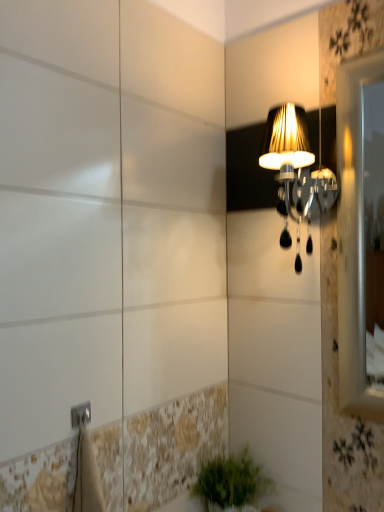
Image resolution: width=384 pixels, height=512 pixels. What are the coordinates of `matte black lampshade at upper right` in the screenshot? It's located at (295, 165).

In order to face matte black lampshade at upper right, should I rotate leftwards or rightwards?

You should rotate right by 13.316 degrees.

The width and height of the screenshot is (384, 512). What do you see at coordinates (295, 165) in the screenshot?
I see `matte black lampshade at upper right` at bounding box center [295, 165].

The width and height of the screenshot is (384, 512). I want to click on green leafy plant at lower center, so click(231, 481).

The image size is (384, 512). Describe the element at coordinates (231, 481) in the screenshot. I see `green leafy plant at lower center` at that location.

I want to click on matte black lampshade at upper right, so click(295, 165).

Considering the relative positions of matte black lampshade at upper right and green leafy plant at lower center in the image provided, is matte black lampshade at upper right to the left or to the right of green leafy plant at lower center?

Clearly, matte black lampshade at upper right is on the right of green leafy plant at lower center in the image.

Which object is further away from the camera taking this photo, matte black lampshade at upper right or green leafy plant at lower center?

green leafy plant at lower center is behind.

Which is farther, (299, 213) or (224, 479)?

Point (224, 479)

Consider the image. From the image's perspective, would you say matte black lampshade at upper right is shown under green leafy plant at lower center?

No, from the image's perspective, matte black lampshade at upper right is not beneath green leafy plant at lower center.

From a real-world perspective, is matte black lampshade at upper right over green leafy plant at lower center?

Yes, from a real-world perspective, matte black lampshade at upper right is above green leafy plant at lower center.

Based on the photo, is matte black lampshade at upper right wider or thinner than green leafy plant at lower center?

matte black lampshade at upper right is wider than green leafy plant at lower center.

Is matte black lampshade at upper right taller than green leafy plant at lower center?

Indeed, matte black lampshade at upper right has a greater height compared to green leafy plant at lower center.

Between matte black lampshade at upper right and green leafy plant at lower center, which one has smaller size?

green leafy plant at lower center is smaller.

Is green leafy plant at lower center inside matte black lampshade at upper right?

No, green leafy plant at lower center is not a part of matte black lampshade at upper right.

Is matte black lampshade at upper right placed right next to green leafy plant at lower center?

No.

Is matte black lampshade at upper right facing towards green leafy plant at lower center?

No, matte black lampshade at upper right is not turned towards green leafy plant at lower center.

Can you tell me how much matte black lampshade at upper right and green leafy plant at lower center differ in facing direction?

They differ by 0.456 degrees in their facing directions.

You are a GUI agent. You are given a task and a screenshot of the screen. Output one action in this format:
    pyautogui.click(x=<x>, y=<y>)
    Task: Click on the houseplant on the left of the matte black lampshade at upper right
    The height and width of the screenshot is (512, 384).
    Given the screenshot: What is the action you would take?
    pyautogui.click(x=231, y=481)

Considering the relative positions of green leafy plant at lower center and matte black lampshade at upper right in the image provided, is green leafy plant at lower center to the right of matte black lampshade at upper right from the viewer's perspective?

Incorrect, green leafy plant at lower center is not on the right side of matte black lampshade at upper right.

Which object is further away from the camera taking this photo, green leafy plant at lower center or matte black lampshade at upper right?

green leafy plant at lower center is further away from the camera.

Is point (235, 481) behind point (301, 201)?

That is True.

From the image's perspective, is green leafy plant at lower center positioned above or below matte black lampshade at upper right?

Based on their image positions, green leafy plant at lower center is located beneath matte black lampshade at upper right.

From a real-world perspective, does green leafy plant at lower center stand above matte black lampshade at upper right?

Incorrect, from a real-world perspective, green leafy plant at lower center is lower than matte black lampshade at upper right.

Can you confirm if green leafy plant at lower center is thinner than matte black lampshade at upper right?

Yes, green leafy plant at lower center is thinner than matte black lampshade at upper right.

Considering the sizes of objects green leafy plant at lower center and matte black lampshade at upper right in the image provided, who is shorter, green leafy plant at lower center or matte black lampshade at upper right?

green leafy plant at lower center.

Does green leafy plant at lower center have a smaller size compared to matte black lampshade at upper right?

Indeed, green leafy plant at lower center has a smaller size compared to matte black lampshade at upper right.

Consider the image. Can we say green leafy plant at lower center lies outside matte black lampshade at upper right?

green leafy plant at lower center is positioned outside matte black lampshade at upper right.

Is green leafy plant at lower center positioned far away from matte black lampshade at upper right?

green leafy plant at lower center is actually quite close to matte black lampshade at upper right.

Is green leafy plant at lower center facing away from matte black lampshade at upper right?

No, green leafy plant at lower center's orientation is not away from matte black lampshade at upper right.

Measure the distance between green leafy plant at lower center and matte black lampshade at upper right.

They are 29.10 inches apart.

Identify the location of lamp above the green leafy plant at lower center (from the image's perspective). (295, 165).

The height and width of the screenshot is (512, 384). In the image, there is a matte black lampshade at upper right. Identify the location of houseplant below it (from a real-world perspective). (231, 481).

The height and width of the screenshot is (512, 384). In order to click on houseplant on the left side of matte black lampshade at upper right in this screenshot , I will do `click(231, 481)`.